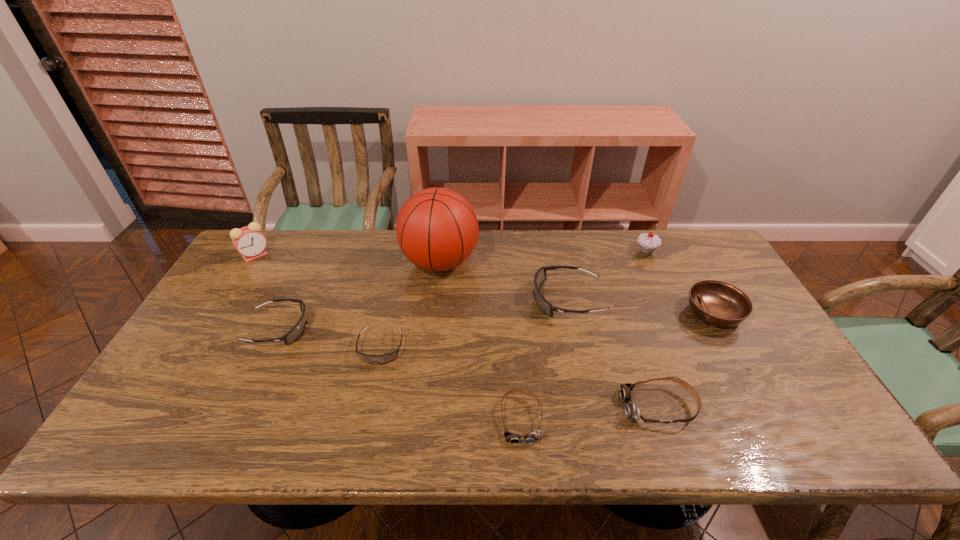
Where is `the third closest goggles to the right brown goggles`? the third closest goggles to the right brown goggles is located at coordinates (388, 357).

At what (x,y) coordinates should I click in order to perform the action: click on black goggles that stands as the closest to the leftmost object. Please return your answer as a coordinate pair (x, y). The image size is (960, 540). Looking at the image, I should click on (295, 333).

At what (x,y) coordinates should I click in order to perform the action: click on black goggles identified as the second closest to the smaller brown goggles. Please return your answer as a coordinate pair (x, y). Looking at the image, I should click on (388, 357).

Image resolution: width=960 pixels, height=540 pixels. I want to click on vacant space that satisfies the following two spatial constraints: 1. on the lenses of the rightmost black goggles; 2. on the lenses of the fourth goggles from right to left, so click(x=578, y=348).